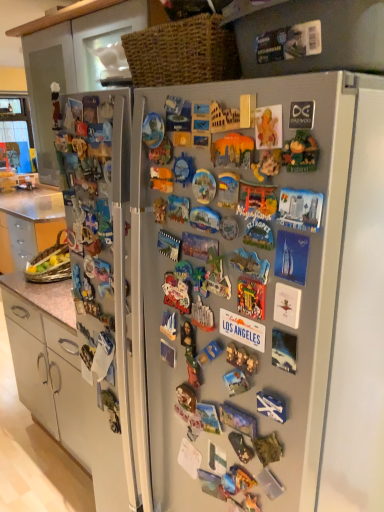
Question: Considering the relative sizes of matte plastic magnet at center, which is the sixth toy in right-to-left order, and matte plastic magnet at center, which is the 8th toy in left-to-right order, in the image provided, is matte plastic magnet at center, which is the sixth toy in right-to-left order, bigger than matte plastic magnet at center, which is the 8th toy in left-to-right order,?

Choices:
 (A) yes
 (B) no

Answer: (A)

Question: Is matte plastic magnet at center, the 5th toy viewed from the left, outside matte plastic magnet at center, which is the third toy from right to left?

Choices:
 (A) no
 (B) yes

Answer: (B)

Question: Is matte plastic magnet at center, the 5th toy viewed from the left, looking in the opposite direction of matte plastic magnet at center, which is the third toy from right to left?

Choices:
 (A) yes
 (B) no

Answer: (B)

Question: Can you confirm if matte plastic magnet at center, the 5th toy viewed from the left, is smaller than matte plastic magnet at center, which is the third toy from right to left?

Choices:
 (A) no
 (B) yes

Answer: (A)

Question: Does matte plastic magnet at center, the 5th toy viewed from the left, come in front of matte plastic magnet at center, which is the 8th toy in left-to-right order?

Choices:
 (A) yes
 (B) no

Answer: (A)

Question: Visually, is wooden irish flag at right, positioned as the first toy in right-to-left order, positioned to the left or to the right of metallic silver toy at center, which ranks as the 6th toy in left-to-right order?

Choices:
 (A) left
 (B) right

Answer: (B)

Question: Considering the positions of wooden irish flag at right, the 10th toy positioned from the left, and metallic silver toy at center, placed as the 5th toy when sorted from right to left, in the image, is wooden irish flag at right, the 10th toy positioned from the left, taller or shorter than metallic silver toy at center, placed as the 5th toy when sorted from right to left,?

Choices:
 (A) short
 (B) tall

Answer: (B)

Question: Considering the positions of wooden irish flag at right, positioned as the first toy in right-to-left order, and metallic silver toy at center, which ranks as the 6th toy in left-to-right order, in the image, is wooden irish flag at right, positioned as the first toy in right-to-left order, wider or thinner than metallic silver toy at center, which ranks as the 6th toy in left-to-right order,?

Choices:
 (A) thin
 (B) wide

Answer: (A)

Question: Based on their sizes in the image, would you say wooden irish flag at right, positioned as the first toy in right-to-left order, is bigger or smaller than metallic silver toy at center, placed as the 5th toy when sorted from right to left?

Choices:
 (A) big
 (B) small

Answer: (B)

Question: Is matte plastic magnet at center, which is the third toy from right to left, wider or thinner than satin silver fridge at center?

Choices:
 (A) wide
 (B) thin

Answer: (B)

Question: Considering their positions, is matte plastic magnet at center, which is the third toy from right to left, located in front of or behind satin silver fridge at center?

Choices:
 (A) front
 (B) behind

Answer: (A)

Question: Is matte plastic magnet at center, which is the 8th toy in left-to-right order, bigger or smaller than satin silver fridge at center?

Choices:
 (A) small
 (B) big

Answer: (A)

Question: Considering the positions of matte plastic magnet at center, which is the third toy from right to left, and satin silver fridge at center in the image, is matte plastic magnet at center, which is the third toy from right to left, taller or shorter than satin silver fridge at center?

Choices:
 (A) short
 (B) tall

Answer: (A)

Question: From a real-world perspective, is matte brown figurine at upper left, the first toy viewed from the left, above or below matte plastic magnet at center, the 5th toy viewed from the left?

Choices:
 (A) below
 (B) above

Answer: (B)

Question: Is point (56, 93) positioned closer to the camera than point (233, 159)?

Choices:
 (A) farther
 (B) closer

Answer: (A)